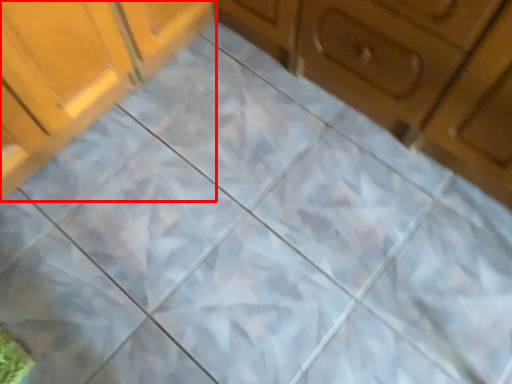
Question: In this image, where is cabinetry (annotated by the red box) located relative to cabinetry?

Choices:
 (A) right
 (B) left

Answer: (B)